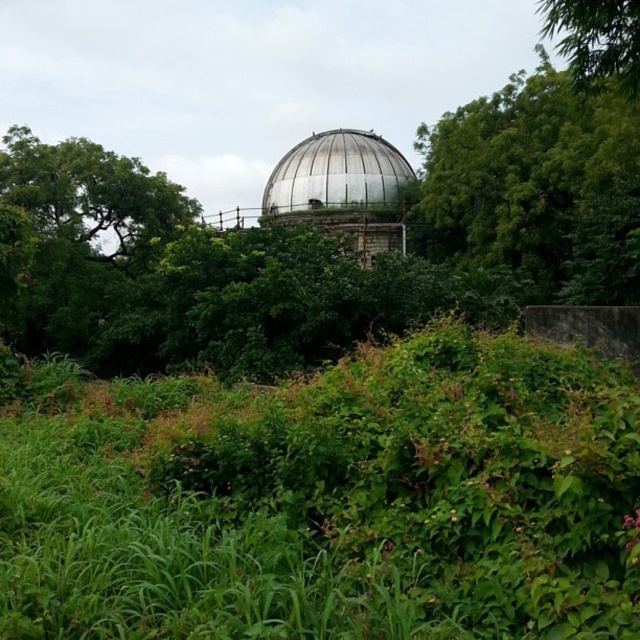
Who is higher up, green leafy tree at upper center or green leafy tree at upper right?

green leafy tree at upper right is above.

Which is behind, point (456, 140) or point (554, 33)?

Point (456, 140)

The height and width of the screenshot is (640, 640). Identify the location of green leafy tree at upper center. (536, 186).

Can you confirm if green leafy tree at upper center is positioned above shiny metallic dome at center?

No.

Between point (435, 221) and point (346, 192), which one is positioned behind?

The point (346, 192) is behind.

At what (x,y) coordinates should I click in order to perform the action: click on green leafy tree at upper center. Please return your answer as a coordinate pair (x, y). Looking at the image, I should click on (536, 186).

Which of these two, green leafy grass at center or shiny metallic dome at center, stands taller?

Standing taller between the two is shiny metallic dome at center.

Who is lower down, green leafy grass at center or shiny metallic dome at center?

green leafy grass at center is below.

This screenshot has height=640, width=640. What do you see at coordinates (330, 499) in the screenshot?
I see `green leafy grass at center` at bounding box center [330, 499].

I want to click on green leafy grass at center, so click(x=330, y=499).